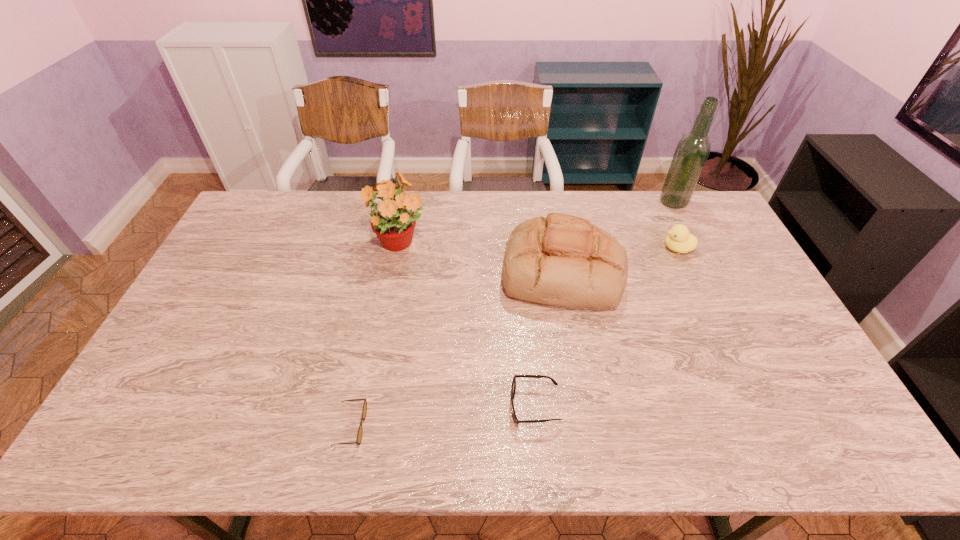
Find the location of a particular element. The image size is (960, 540). duckling that is at the right edge is located at coordinates click(679, 239).

The height and width of the screenshot is (540, 960). Identify the location of object present at the far right corner. (x=692, y=151).

Image resolution: width=960 pixels, height=540 pixels. In the image, there is a desktop. Identify the location of vacant space at the far edge. (332, 191).

Where is `free space at the near edge`? The height and width of the screenshot is (540, 960). free space at the near edge is located at coordinates (198, 436).

This screenshot has height=540, width=960. I want to click on vacant region at the left edge, so click(x=228, y=276).

In the image, there is a desktop. Where is `vacant space at the right edge`? The height and width of the screenshot is (540, 960). vacant space at the right edge is located at coordinates (772, 368).

In the image, there is a desktop. Identify the location of vacant space at the far left corner. (281, 201).

Locate an element on the screen. empty space that is in between the third tallest object and the liquor is located at coordinates (617, 237).

What are the coordinates of `free spot between the bread and the right sunglasses` in the screenshot? It's located at (548, 339).

Where is `free space between the fourth tallest object and the left sunglasses`? This screenshot has width=960, height=540. free space between the fourth tallest object and the left sunglasses is located at coordinates (515, 338).